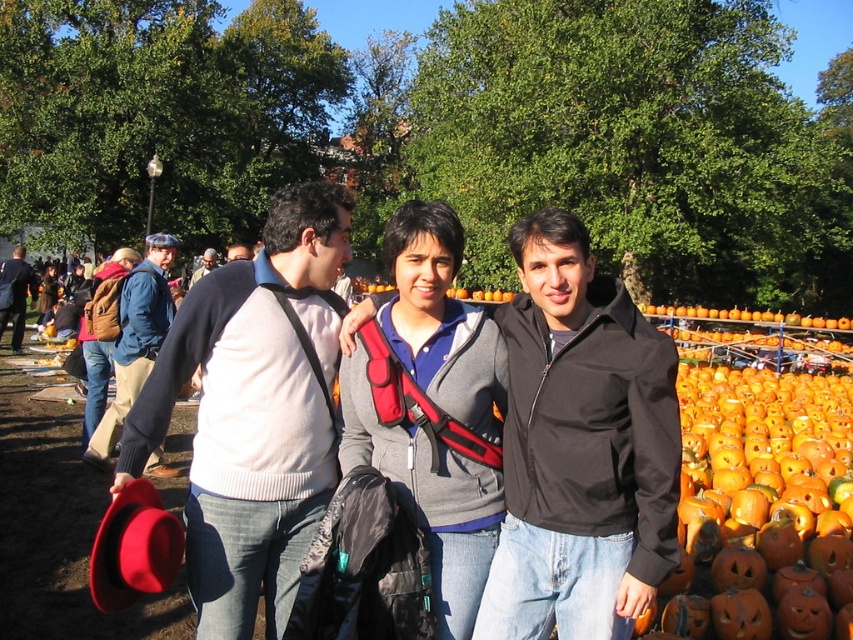
You are a photographer trying to arrange a group photo. You have two people wearing the denim jacket at left and the matte gray sweater at center. According to the scene, which clothing item is positioned to the right of the other?

The denim jacket at left is positioned on the right side of matte gray sweater at center.

You are standing in the park and see the denim jacket at left and the matte gray sweater at center. Which clothing item is positioned lower in the image?

The denim jacket at left is positioned lower than the matte gray sweater at center in the image.

You are a photographer setting up a tripod in the center of the scene. You notice the black smooth jacket at center and the matte black sweater at center. Which object should you avoid placing the tripod next to if you want to keep it closer to the narrower item?

You should avoid placing the tripod next to the matte black sweater at center because the black smooth jacket at center is narrower, so placing the tripod near the narrower item would require keeping it closer to the black smooth jacket at center, thus avoiding the wider matte black sweater at center.